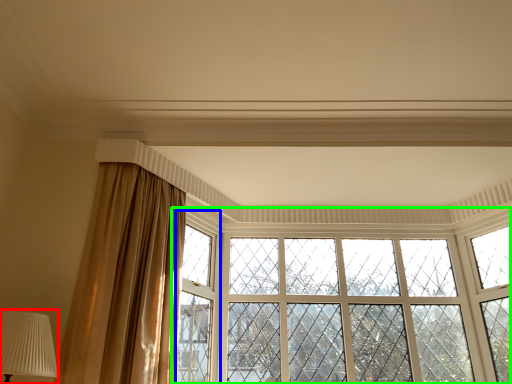
Question: Considering the real-world distances, which object is closest to table lamp (highlighted by a red box)? window frame (highlighted by a blue box) or window (highlighted by a green box).

Choices:
 (A) window frame
 (B) window

Answer: (A)